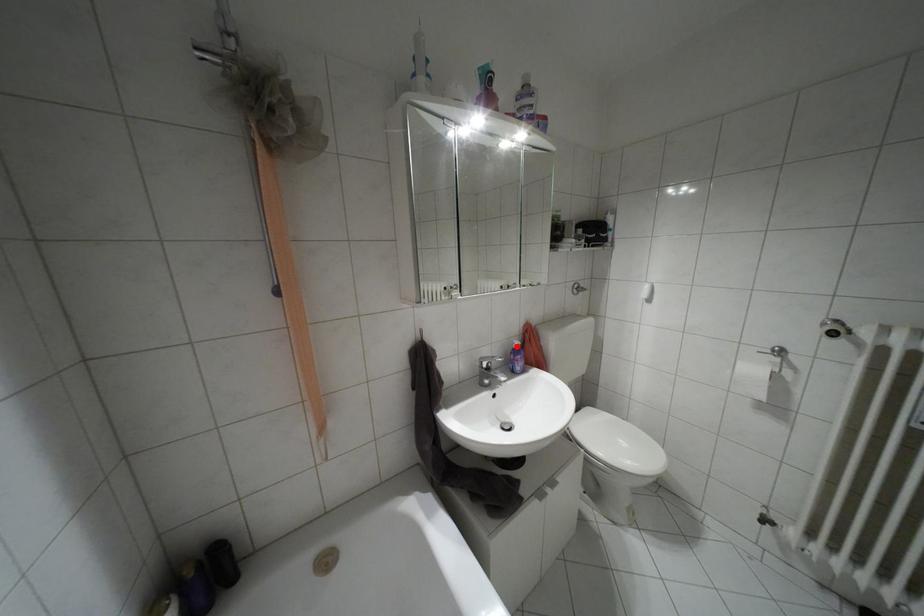
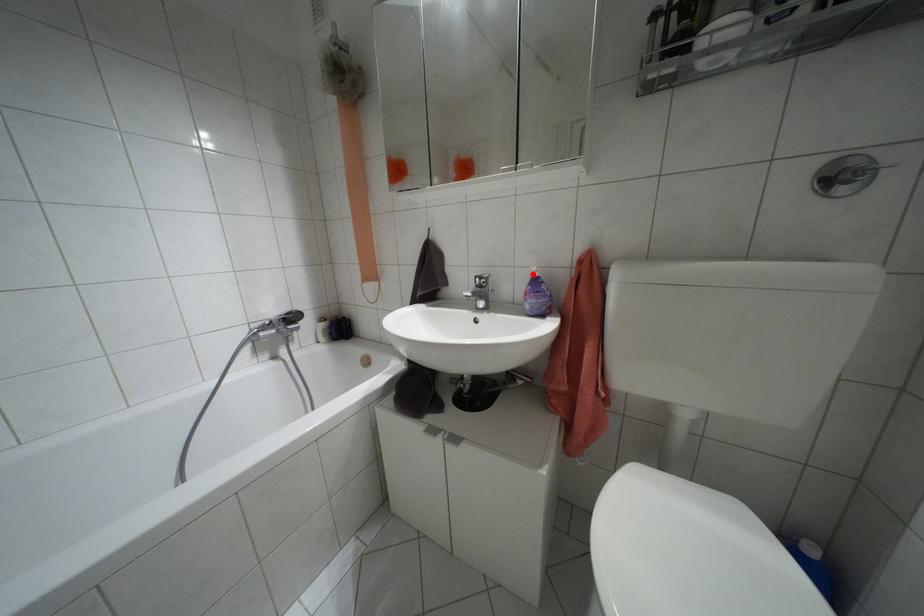
I am providing you with two images of the same scene from different viewpoints. A red point is marked on the first image and another point is marked on the second image. Does the point marked in image1 correspond to the same location as the one in image2?

Yes